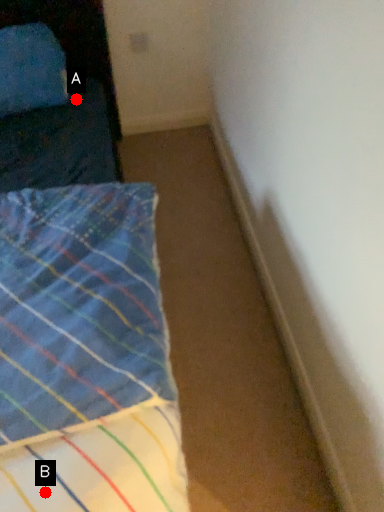
Question: Two points are circled on the image, labeled by A and B beside each circle. Which point is further to the camera?

Choices:
 (A) A is further
 (B) B is further

Answer: (A)